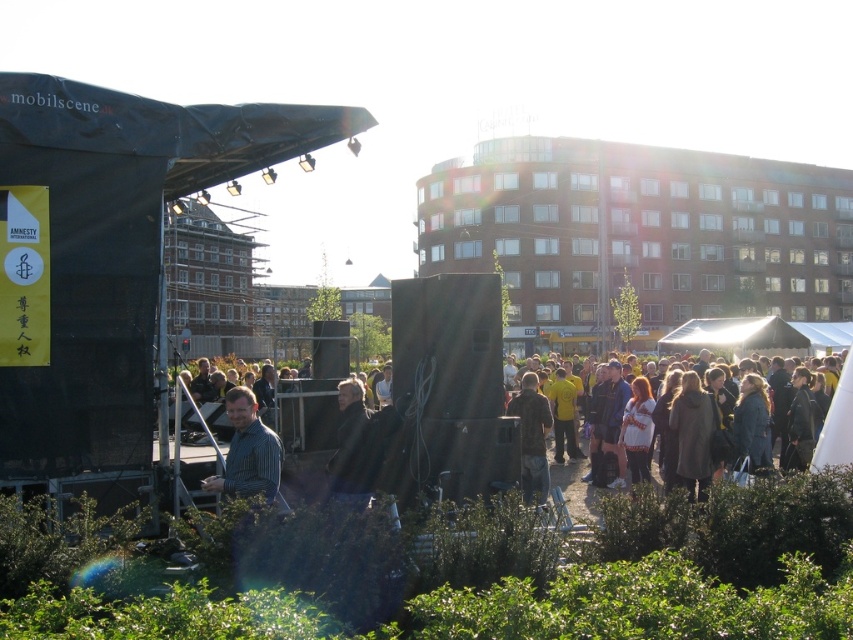
Where is the striped shirt at center located in the image?

The striped shirt at center is located at point coordinates of 0.706 in the x axis and 0.291 in the y axis.

You are organizing a photo shoot and need to ensure that the striped shirt at center and the camouflage fabric jacket at center are both visible in the frame. Given their sizes, which clothing item should be placed closer to the camera to maintain visibility?

The striped shirt at center has a smaller width than the camouflage fabric jacket at center. To ensure both are visible, the striped shirt at center should be placed closer to the camera since its smaller size can be positioned nearer to compensate for its smaller dimensions, while the larger camouflage fabric jacket at center can be slightly farther back but still remain visible in the frame.